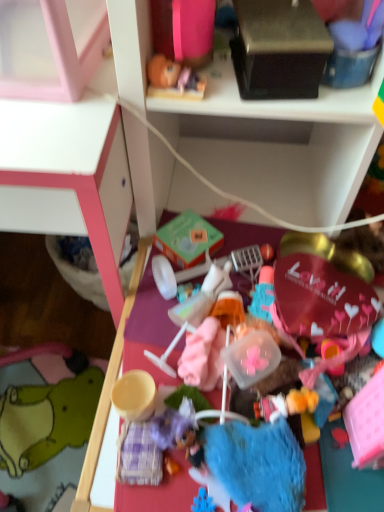
Question: Considering their positions, is white plastic shelf at upper center located in front of or behind black matte box at upper center?

Choices:
 (A) behind
 (B) front

Answer: (B)

Question: Based on their sizes in the image, would you say white plastic shelf at upper center is bigger or smaller than black matte box at upper center?

Choices:
 (A) big
 (B) small

Answer: (A)

Question: Which of these objects is positioned closest to the white plastic shelf at upper center?

Choices:
 (A) black matte box at upper center
 (B) plastic toy at center
 (C) green felt plush at lower left

Answer: (B)

Question: Which of these objects is positioned farthest from the green felt plush at lower left?

Choices:
 (A) black matte box at upper center
 (B) white plastic shelf at upper center
 (C) plastic toy at center

Answer: (A)